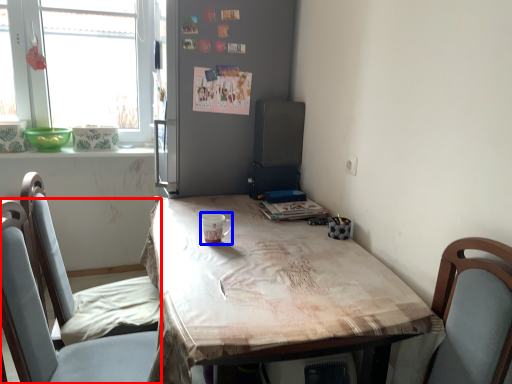
Question: Which point is closer to the camera, chair (highlighted by a red box) or coffee cup (highlighted by a blue box)?

Choices:
 (A) chair
 (B) coffee cup

Answer: (A)